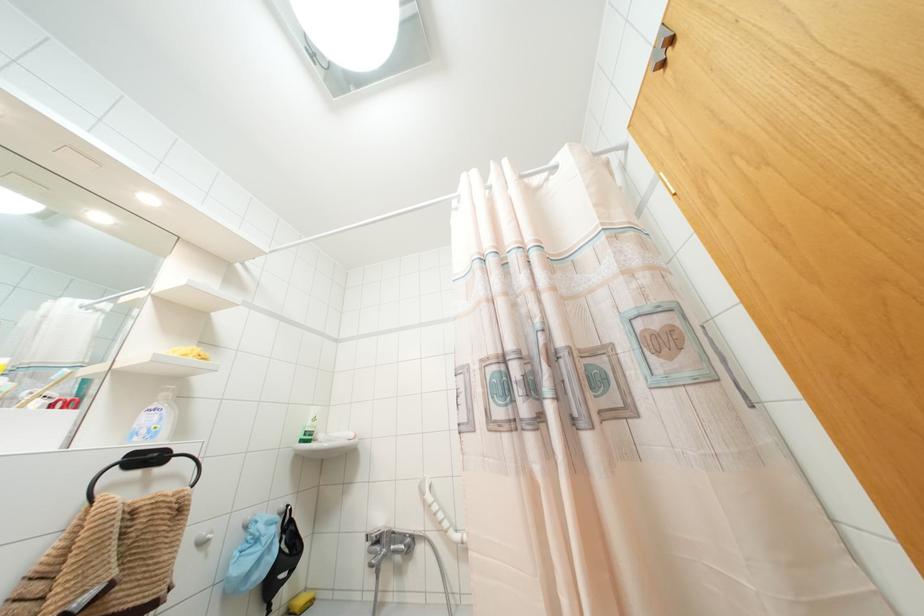
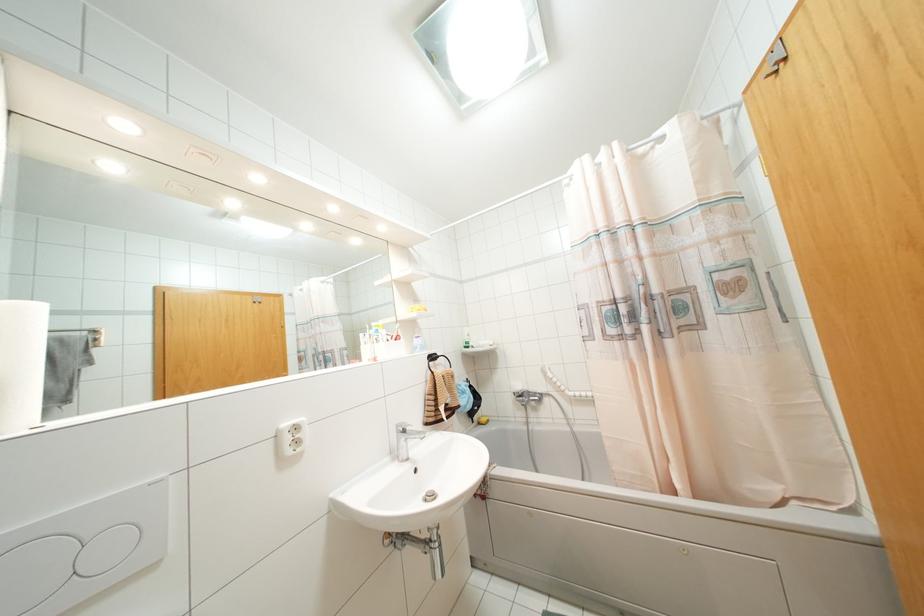
The point at (312, 419) is marked in the first image. Where is the corresponding point in the second image?

(468, 334)